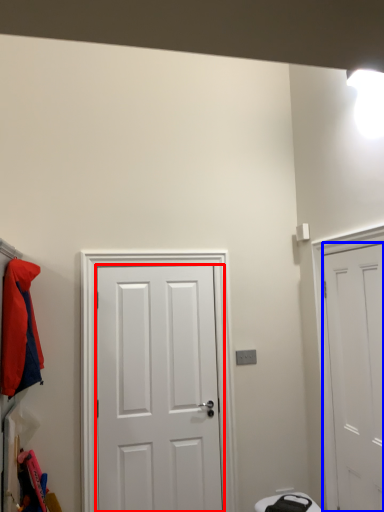
Question: Among these objects, which one is farthest to the camera, door (highlighted by a red box) or door (highlighted by a blue box)?

Choices:
 (A) door
 (B) door

Answer: (A)